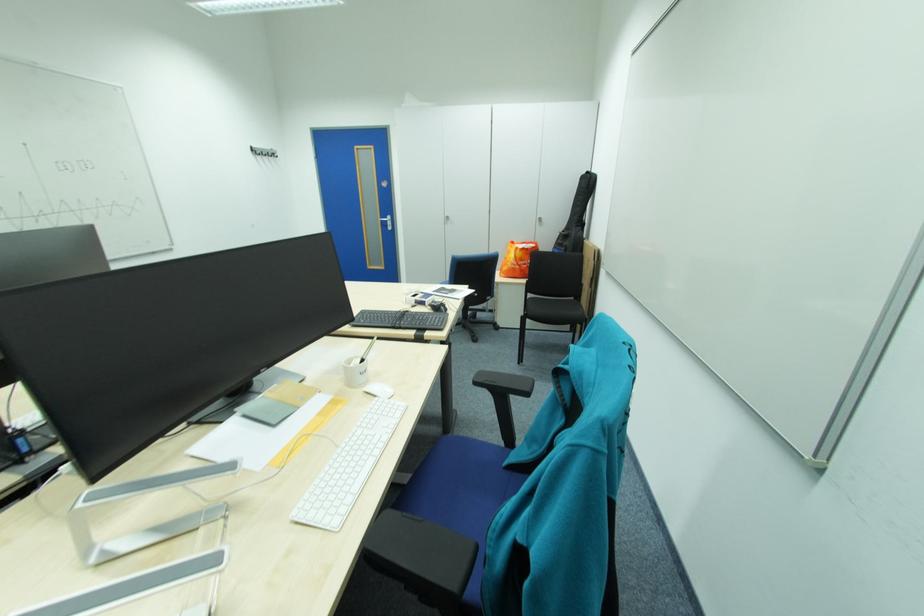
Where is `orange shopping bag`? The width and height of the screenshot is (924, 616). orange shopping bag is located at coordinates (517, 259).